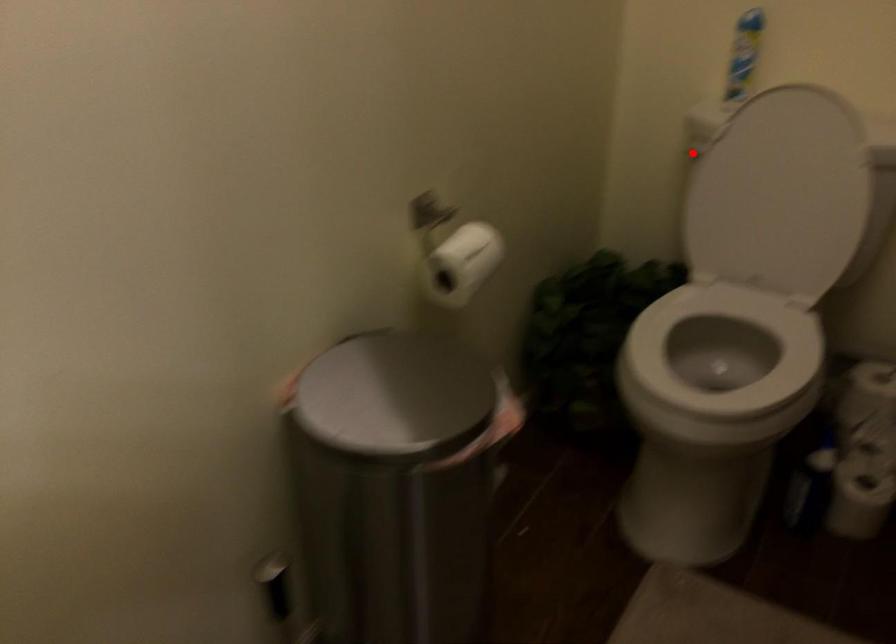
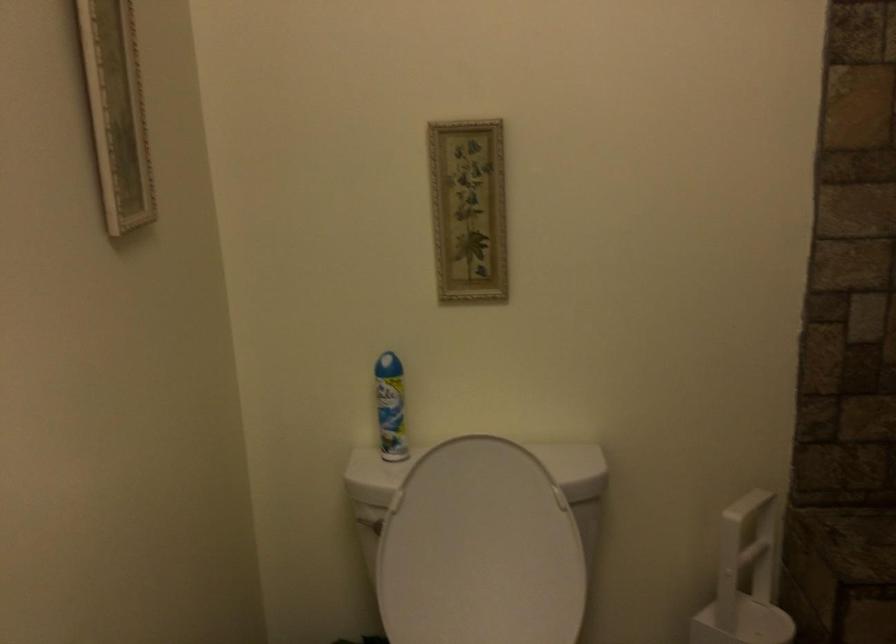
Question: I am providing you with two images of the same scene from different viewpoints. In image1, a red point is highlighted. Considering the same 3D point in image2, which of the following is correct?

Choices:
 (A) It is closer
 (B) It is farther

Answer: (A)